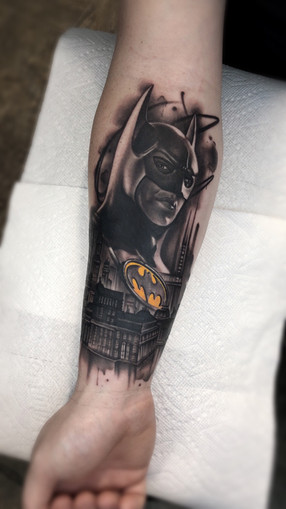
In order to click on paper towel in this screenshot , I will do (x=191, y=378).